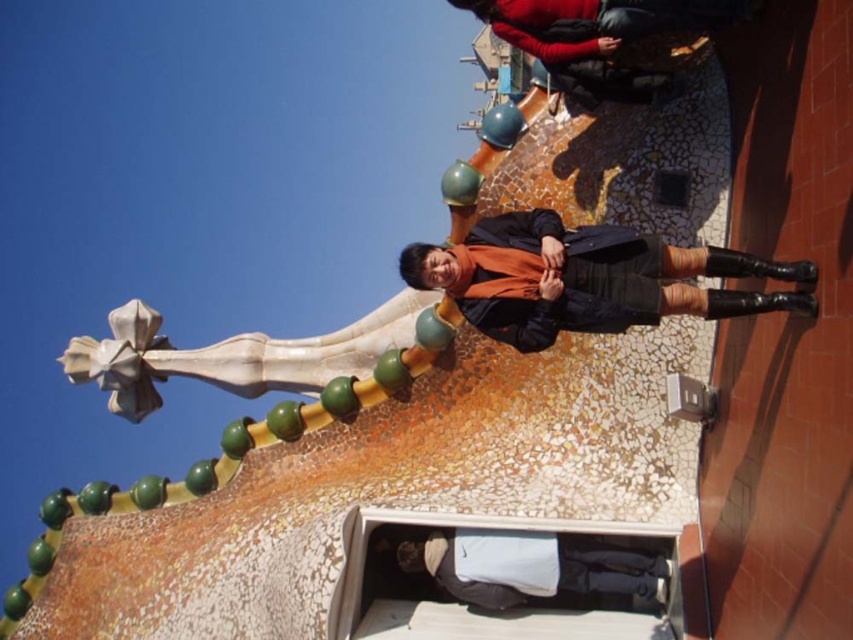
You are a photographer trying to capture the best angle of the architectural structure. You notice two points on the roof marked as point 1 at coordinates (566, 317) and point 2 at coordinates (656, 602). Which point is closer to your camera lens?

Point 1 at coordinates (566, 317) is closer to the camera lens than point 2 at coordinates (656, 602).

You are a photographer trying to capture the person on the roof. The matte black coat at center and the dark gray fabric pants at lower center are both in the frame. Which clothing item appears larger in the photo?

The matte black coat at center appears larger in the photo because it is bigger than the dark gray fabric pants at lower center according to the description.

You are a photographer trying to capture a clear shot of the person standing on the roof. The camera you are using has a limited field of view. If you focus on the matte black coat at center, will you also be able to include the dark gray fabric pants at lower center in the same frame?

The matte black coat at center might be wider than dark gray fabric pants at lower center, so there is a possibility that focusing on the coat could block or obscure the pants from the frame. To ensure both are visible, adjust the camera angle or zoom level accordingly.